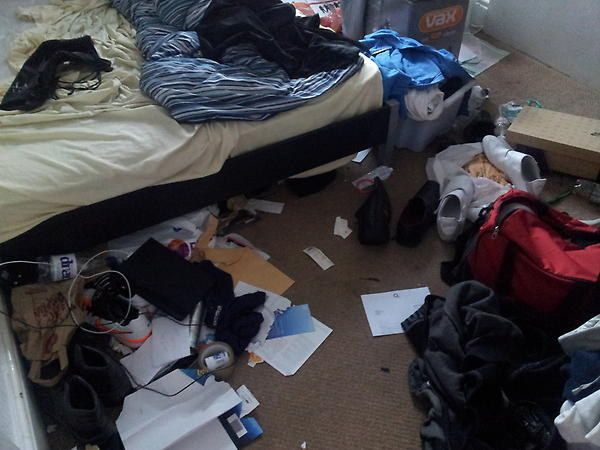
I want to click on shoe box, so click(x=568, y=145).